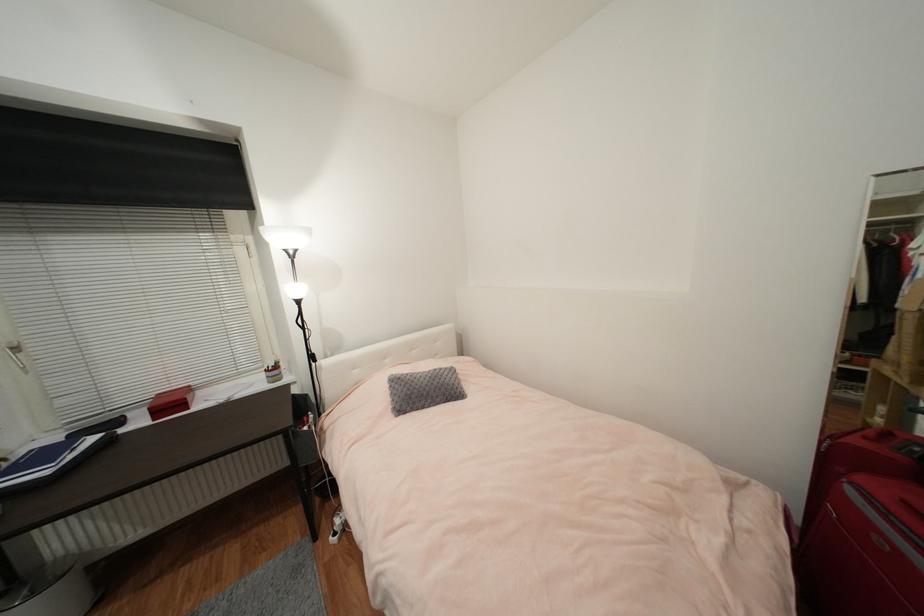
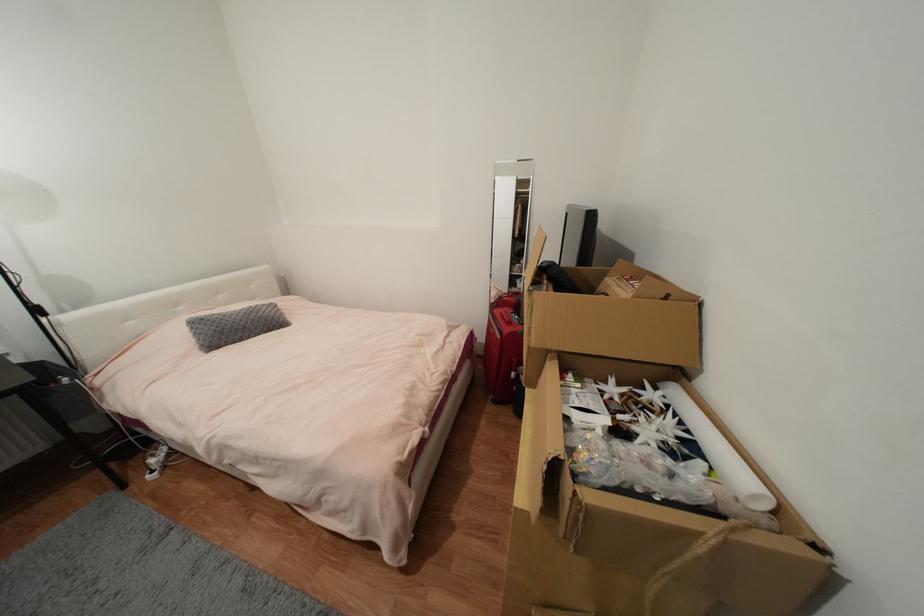
Question: The images are taken continuously from a first-person perspective. In which direction is your viewpoint rotating?

Choices:
 (A) Left
 (B) Right
 (C) Up
 (D) Down

Answer: (B)